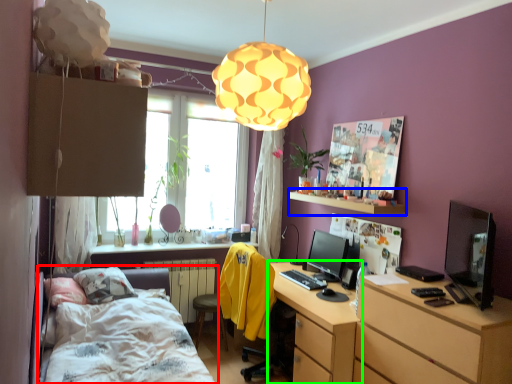
Question: Based on their relative distances, which object is farther from bed (highlighted by a red box)? Choose from shelf (highlighted by a blue box) and desk (highlighted by a green box).

Choices:
 (A) shelf
 (B) desk

Answer: (A)